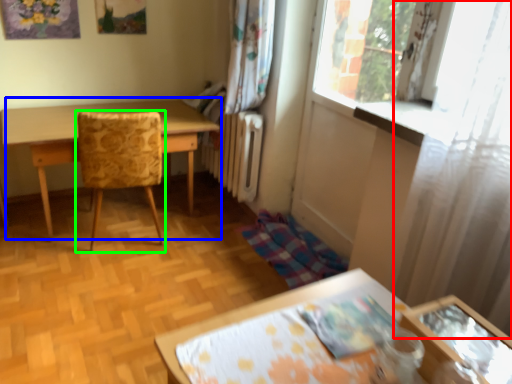
Question: Estimate the real-world distances between objects in this image. Which object is closer to curtain (highlighted by a red box), table (highlighted by a blue box) or chair (highlighted by a green box)?

Choices:
 (A) table
 (B) chair

Answer: (B)